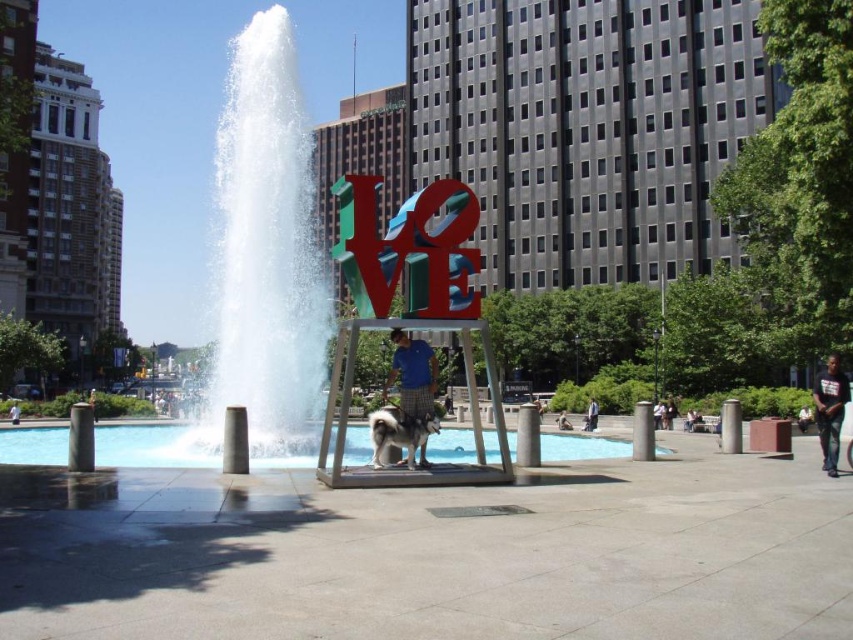
You are standing at the entrance of the plaza and want to reach a specific point marked at coordinates point (270, 179). If your walking speed is 3 feet per second, how many seconds will it take you to reach that point?

The distance of point (270, 179) from viewer is 92.71 feet. At a walking speed of 3 feet per second, it will take approximately 30.9 seconds to reach the point.

You are standing in the plaza and see the white water at center and the white cotton shirt at center. Which object is closer to your left side?

The white water at center is positioned on the left side of the white cotton shirt at center, so the white water at center is closer to your left side.

You are standing in the plaza and see two shirts at the center of the scene. Which shirt is nearer to you, the blue cotton shirt at center or the dark blue shirt at center?

The blue cotton shirt at center is closer to the viewer than the dark blue shirt at center.